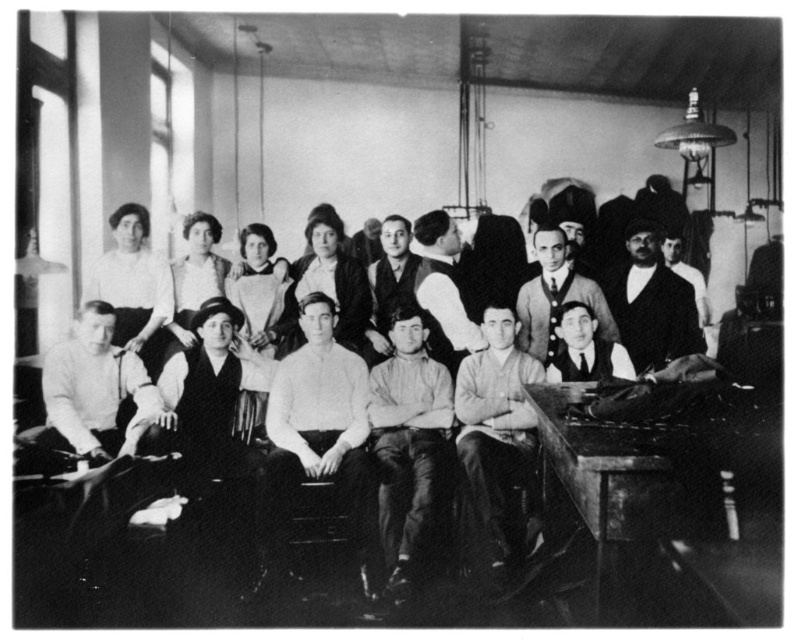
Who is lower down, smooth gray sweater at center or smooth white shirt at center?

smooth gray sweater at center is below.

Does smooth gray sweater at center have a lesser height compared to smooth white shirt at center?

Correct, smooth gray sweater at center is not as tall as smooth white shirt at center.

Who is more distant from viewer, (539, 308) or (431, 241)?

Positioned behind is point (431, 241).

Identify the location of smooth gray sweater at center. This screenshot has width=798, height=640. (555, 296).

Is smooth white blouse at upper left further to camera compared to smooth white shirt at center?

No, it is not.

Is smooth white blouse at upper left smaller than smooth white shirt at center?

Indeed, smooth white blouse at upper left has a smaller size compared to smooth white shirt at center.

Is point (164, 332) positioned after point (441, 259)?

That is False.

The image size is (798, 640). I want to click on smooth white blouse at upper left, so click(x=133, y=285).

Can you confirm if wooden table at lower right is smaller than smooth gray vest at center?

Actually, wooden table at lower right might be larger than smooth gray vest at center.

Between point (609, 540) and point (394, 275), which one is positioned behind?

The point (394, 275) is behind.

What are the coordinates of `wooden table at lower right` in the screenshot? It's located at (674, 500).